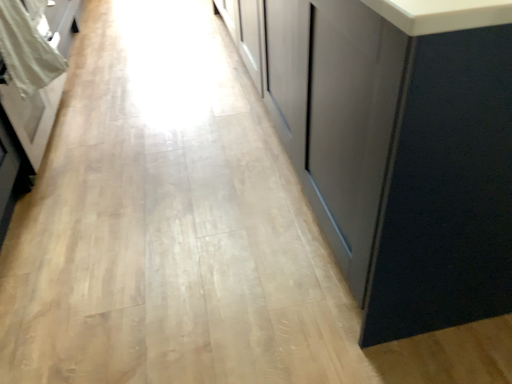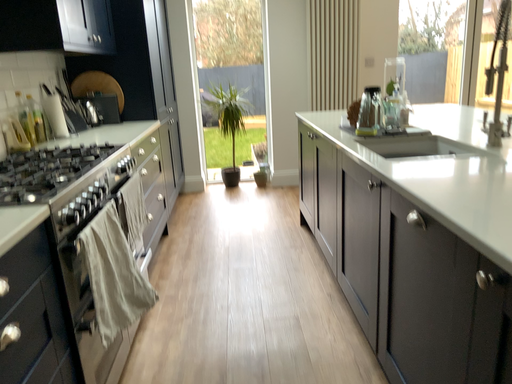
Question: Which way did the camera rotate in the video?

Choices:
 (A) rotated upward
 (B) rotated downward

Answer: (A)